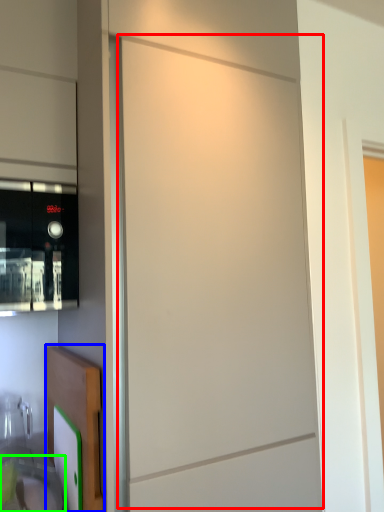
Question: Which object is positioned farthest from screen door (highlighted by a red box)? Select from cabinetry (highlighted by a blue box) and sink (highlighted by a green box).

Choices:
 (A) cabinetry
 (B) sink

Answer: (B)